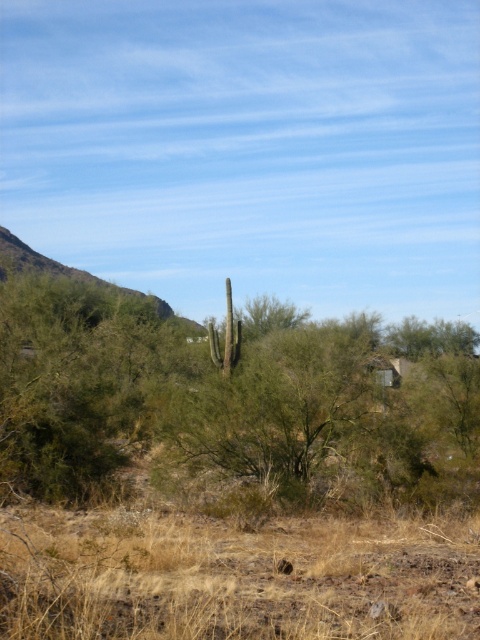
You are a desert explorer who wants to find shade to rest. You see a green leafy tree at center and brown dry grass at center. Which location would provide shade?

The green leafy tree at center is positioned on the left side of brown dry grass at center, so the green leafy tree at center would provide shade.

You are a hiker who has lost their way in the desert. You see a green leafy tree at center and brown dry grass at center. Which one is closer to you?

The green leafy tree at center and brown dry grass at center are 12.42 meters apart, but the question does not specify which is closer. However, since both are at the center, they are equidistant from your current position.

You are a desert explorer trying to navigate between the green leafy tree at center and the brown dry grass at center. Which one should you avoid stepping on to prevent damaging the environment?

The green leafy tree at center might be wider than brown dry grass at center, so it is more likely to have a larger root system. To prevent damaging the environment, you should avoid stepping on the green leafy tree at center.